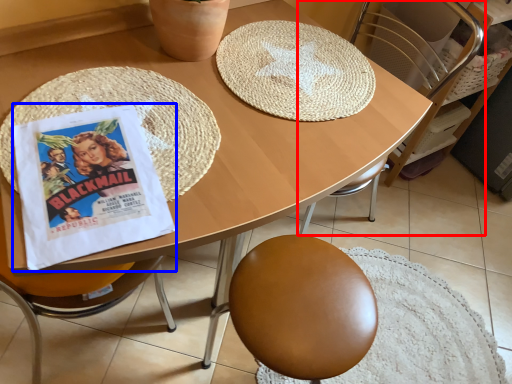
Question: Which object appears farthest to the camera in this image, chair (highlighted by a red box) or comic book (highlighted by a blue box)?

Choices:
 (A) chair
 (B) comic book

Answer: (A)